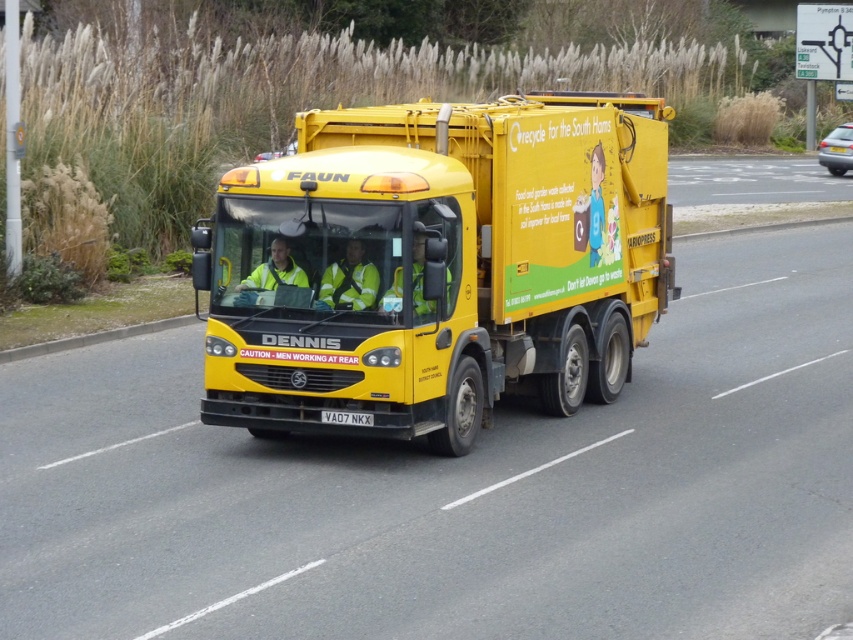
Question: Is yellow matte trailer truck at center closer to camera compared to black plastic license plate at center?

Choices:
 (A) yes
 (B) no

Answer: (B)

Question: Can you confirm if yellow matte trailer truck at center is positioned above black plastic license plate at center?

Choices:
 (A) no
 (B) yes

Answer: (B)

Question: Based on their relative distances, which object is nearer to the black plastic license plate at center?

Choices:
 (A) yellow matte trailer truck at center
 (B) metallic silver car at right

Answer: (A)

Question: Among these points, which one is farthest from the camera?

Choices:
 (A) (846, 161)
 (B) (248, 291)
 (C) (335, 413)

Answer: (A)

Question: Is yellow matte trailer truck at center further to camera compared to black plastic license plate at center?

Choices:
 (A) no
 (B) yes

Answer: (B)

Question: Which point is farther from the camera taking this photo?

Choices:
 (A) (540, 381)
 (B) (817, 154)
 (C) (340, 413)

Answer: (B)